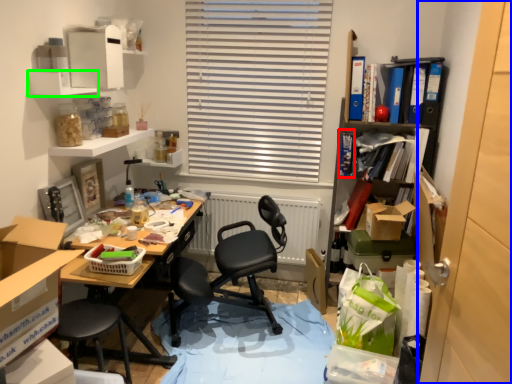
Question: Which object is positioned closest to book (highlighted by a red box)? Select from screen door (highlighted by a blue box) and shelf (highlighted by a green box).

Choices:
 (A) screen door
 (B) shelf

Answer: (B)